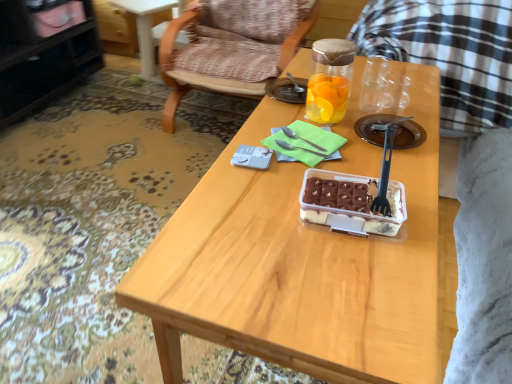
This screenshot has height=384, width=512. Find the location of `free space in front of satin silver fork at center, which appears as the first fork when viewed from the back`. free space in front of satin silver fork at center, which appears as the first fork when viewed from the back is located at coordinates (292, 172).